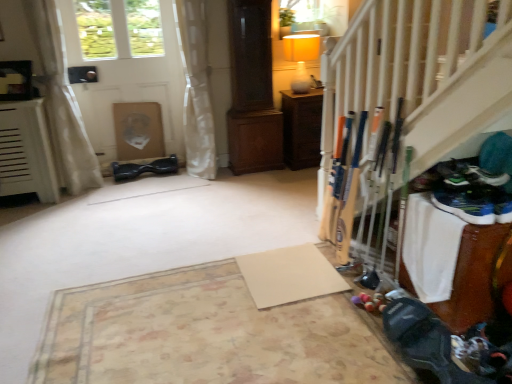
Question: Should I look upward or downward to see white sheer curtain at left, the second curtain from the right?

Choices:
 (A) down
 (B) up

Answer: (B)

Question: Is white matte door at upper left thinner than white sheer curtain at upper left, which is the 2th curtain from left to right?

Choices:
 (A) yes
 (B) no

Answer: (A)

Question: Is white matte door at upper left located outside white sheer curtain at upper left, which is the 2th curtain from left to right?

Choices:
 (A) no
 (B) yes

Answer: (B)

Question: From a real-world perspective, is white matte door at upper left on white sheer curtain at upper left, acting as the first curtain starting from the right?

Choices:
 (A) no
 (B) yes

Answer: (B)

Question: Could you tell me if white matte door at upper left is turned towards white sheer curtain at upper left, acting as the first curtain starting from the right?

Choices:
 (A) no
 (B) yes

Answer: (A)

Question: From the image's perspective, is white matte door at upper left above white sheer curtain at upper left, acting as the first curtain starting from the right?

Choices:
 (A) yes
 (B) no

Answer: (A)

Question: Can you see white matte door at upper left touching white sheer curtain at upper left, acting as the first curtain starting from the right?

Choices:
 (A) no
 (B) yes

Answer: (A)

Question: Does beige matte yoga mat at center, the 1th yoga mat from the right, turn towards wooden cabinet at center?

Choices:
 (A) no
 (B) yes

Answer: (A)

Question: Is wooden cabinet at center located within beige matte yoga mat at center, the 1th yoga mat from the right?

Choices:
 (A) yes
 (B) no

Answer: (B)

Question: Is beige matte yoga mat at center, which is the 2th yoga mat in left-to-right order, to the left of wooden cabinet at center from the viewer's perspective?

Choices:
 (A) yes
 (B) no

Answer: (A)

Question: Is beige matte yoga mat at center, the 1th yoga mat from the right, thinner than wooden cabinet at center?

Choices:
 (A) no
 (B) yes

Answer: (A)

Question: From the image's perspective, is beige matte yoga mat at center, the 1th yoga mat from the right, below wooden cabinet at center?

Choices:
 (A) yes
 (B) no

Answer: (A)

Question: Is beige matte yoga mat at center, the 1th yoga mat from the right, positioned with its back to wooden cabinet at center?

Choices:
 (A) yes
 (B) no

Answer: (B)

Question: Is wooden cabinet at center wider than white sheer curtain at left, the second curtain from the right?

Choices:
 (A) no
 (B) yes

Answer: (B)